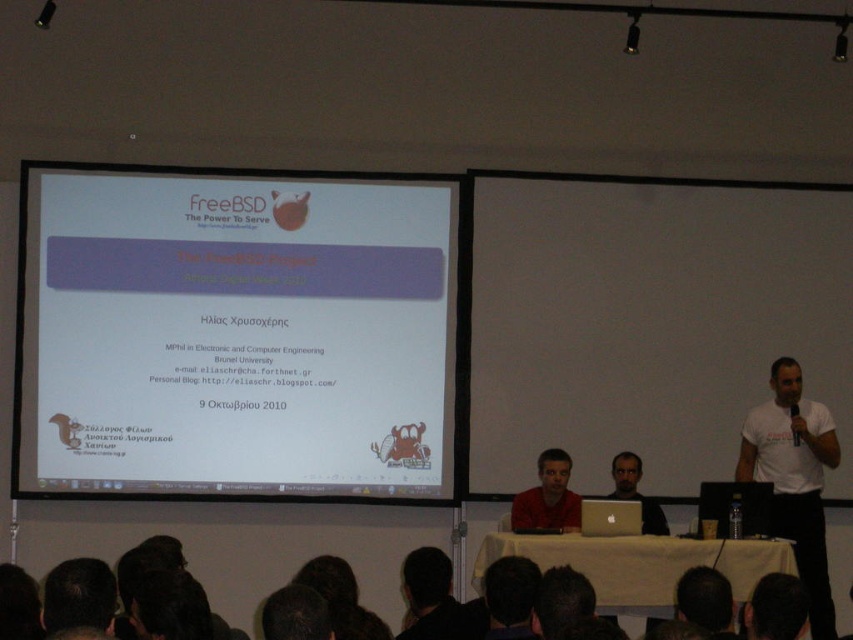
You are an attendee at the presentation and want to take a photo of both the white matte projector screen at center and the matte black laptop at center. Which one should you focus on first to ensure both are in frame?

The white matte projector screen at center is located above the matte black laptop at center, so you should focus on the matte black laptop at center first to ensure both are in frame.

You are a presenter who needs to walk from the white matte projector screen at center to the matte black laptop at center during your talk. Given that you have a stride length of 2.39 feet per step, how many steps will it take you to reach the laptop from the screen?

The distance between the white matte projector screen at center and the matte black laptop at center is 7.18 feet. With a stride length of 2.39 feet per step, dividing 7.18 by 2.39 gives approximately 3 steps. Therefore, it will take you about 3 steps to reach the laptop from the screen.